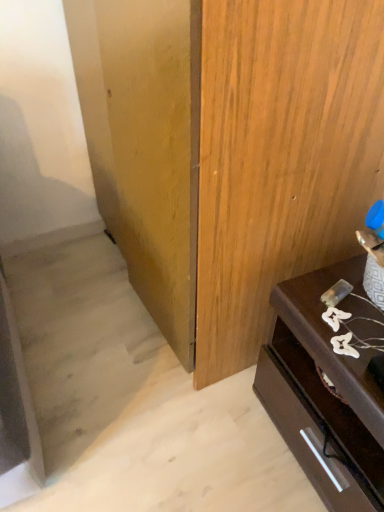
In order to face dark brown wood chest of drawers at lower right, should I rotate leftwards or rightwards?

Rotate right and turn 22.834 degrees.

Identify the location of dark brown wood chest of drawers at lower right. (326, 389).

Image resolution: width=384 pixels, height=512 pixels. What do you see at coordinates (326, 389) in the screenshot?
I see `dark brown wood chest of drawers at lower right` at bounding box center [326, 389].

The image size is (384, 512). Identify the location of dark brown wood chest of drawers at lower right. pyautogui.click(x=326, y=389).